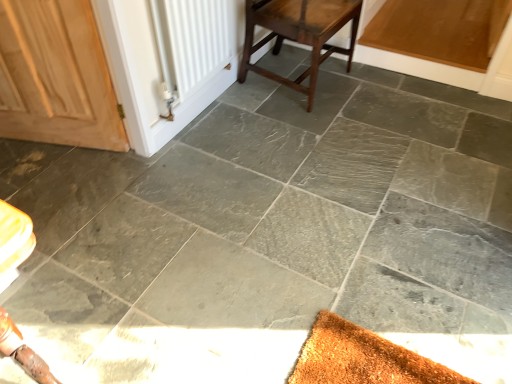
Locate an element on the screen. white matte radiator at upper left is located at coordinates (195, 41).

Is dark brown wood stool at center inside the boundaries of white matte radiator at upper left, or outside?

dark brown wood stool at center exists outside the volume of white matte radiator at upper left.

Considering their positions, is dark brown wood stool at center located in front of or behind white matte radiator at upper left?

In the image, dark brown wood stool at center appears behind white matte radiator at upper left.

Is dark brown wood stool at center positioned with its back to white matte radiator at upper left?

No.

How many degrees apart are the facing directions of dark brown wood stool at center and white matte radiator at upper left?

The facing directions of dark brown wood stool at center and white matte radiator at upper left are 1.58 degrees apart.

Is wooden door at left in front of white matte radiator at upper left?

Yes, wooden door at left is closer to the viewer.

Considering the relative sizes of wooden door at left and white matte radiator at upper left in the image provided, is wooden door at left bigger than white matte radiator at upper left?

Yes.

From a real-world perspective, is wooden door at left physically above white matte radiator at upper left?

Actually, wooden door at left is physically below white matte radiator at upper left in the real world.

Is there a large distance between wooden door at left and white matte radiator at upper left?

No, wooden door at left is in close proximity to white matte radiator at upper left.

Which is in front, point (169, 83) or point (40, 125)?

The point (169, 83) is in front.

Is white matte radiator at upper left not within wooden door at left?

Yes.

Looking at this image, is white matte radiator at upper left oriented away from wooden door at left?

white matte radiator at upper left does not have its back to wooden door at left.

Considering the positions of points (337, 22) and (23, 34), is point (337, 22) farther from camera compared to point (23, 34)?

Yes, it is.

Considering the relative sizes of dark brown wood stool at center and wooden door at left in the image provided, is dark brown wood stool at center thinner than wooden door at left?

No.

From the image's perspective, does dark brown wood stool at center appear lower than wooden door at left?

No.

From a real-world perspective, which is physically above, dark brown wood stool at center or wooden door at left?

From a 3D spatial view, wooden door at left is above.

From a real-world perspective, which object stands above the other?

wooden door at left is physically above.

Which object is further away from the camera taking this photo, wooden door at left or dark brown wood stool at center?

Positioned behind is dark brown wood stool at center.

Between point (22, 39) and point (286, 21), which one is positioned behind?

The point (286, 21) is farther.

What are the coordinates of `stool that appears behind the wooden door at left` in the screenshot? It's located at (298, 34).

Considering the positions of objects white matte radiator at upper left and dark brown wood stool at center in the image provided, who is in front, white matte radiator at upper left or dark brown wood stool at center?

white matte radiator at upper left is more forward.

Considering the sizes of white matte radiator at upper left and dark brown wood stool at center in the image, is white matte radiator at upper left bigger or smaller than dark brown wood stool at center?

In the image, white matte radiator at upper left appears to be smaller than dark brown wood stool at center.

Considering the positions of points (233, 11) and (324, 46), is point (233, 11) closer to camera compared to point (324, 46)?

Yes.

Where is `stool below the white matte radiator at upper left (from a real-world perspective)`? stool below the white matte radiator at upper left (from a real-world perspective) is located at coordinates (298, 34).

Where is `radiator lying on the left of dark brown wood stool at center`? radiator lying on the left of dark brown wood stool at center is located at coordinates (195, 41).

Where is `radiator above the wooden door at left (from the image's perspective)`? The image size is (512, 384). radiator above the wooden door at left (from the image's perspective) is located at coordinates (195, 41).

Which object lies nearer to the anchor point wooden door at left, dark brown wood stool at center or white matte radiator at upper left?

white matte radiator at upper left lies closer to wooden door at left than the other object.

When comparing their distances from dark brown wood stool at center, does wooden door at left or white matte radiator at upper left seem closer?

Based on the image, white matte radiator at upper left appears to be nearer to dark brown wood stool at center.

From the image, which object appears to be nearer to white matte radiator at upper left, dark brown wood stool at center or wooden door at left?

Among the two, dark brown wood stool at center is located nearer to white matte radiator at upper left.

Estimate the real-world distances between objects in this image. Which object is closer to white matte radiator at upper left, wooden door at left or dark brown wood stool at center?

Among the two, dark brown wood stool at center is located nearer to white matte radiator at upper left.

Based on their spatial positions, is white matte radiator at upper left or wooden door at left further from dark brown wood stool at center?

Based on the image, wooden door at left appears to be further to dark brown wood stool at center.

Considering their positions, is white matte radiator at upper left positioned closer to wooden door at left than dark brown wood stool at center?

white matte radiator at upper left is closer to wooden door at left.

The height and width of the screenshot is (384, 512). Find the location of `radiator between wooden door at left and dark brown wood stool at center from left to right`. radiator between wooden door at left and dark brown wood stool at center from left to right is located at coordinates (195, 41).